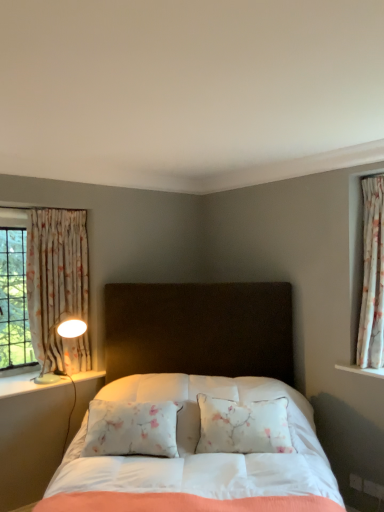
Question: Could you tell me if floral fabric curtain at left, which is the 2th curtain in right-to-left order, is turned towards white glossy lamp at left?

Choices:
 (A) no
 (B) yes

Answer: (A)

Question: Are floral fabric curtain at left, which is the first curtain in left-to-right order, and white glossy lamp at left beside each other?

Choices:
 (A) yes
 (B) no

Answer: (B)

Question: From a real-world perspective, does floral fabric curtain at left, arranged as the 2th curtain when viewed from the front, stand above white glossy lamp at left?

Choices:
 (A) no
 (B) yes

Answer: (B)

Question: Is floral fabric curtain at left, which is the first curtain in left-to-right order, outside of white glossy lamp at left?

Choices:
 (A) no
 (B) yes

Answer: (B)

Question: Is floral fabric curtain at left, which is the first curtain in left-to-right order, thinner than white glossy lamp at left?

Choices:
 (A) no
 (B) yes

Answer: (B)

Question: From the image's perspective, is floral fabric curtain at left, arranged as the 2th curtain when viewed from the front, below white glossy lamp at left?

Choices:
 (A) no
 (B) yes

Answer: (A)

Question: From the image's perspective, is white fabric bed at center under white glossy lamp at left?

Choices:
 (A) yes
 (B) no

Answer: (A)

Question: Is white fabric bed at center next to white glossy lamp at left and touching it?

Choices:
 (A) yes
 (B) no

Answer: (B)

Question: Would you say white fabric bed at center is outside white glossy lamp at left?

Choices:
 (A) no
 (B) yes

Answer: (B)

Question: Is white fabric bed at center to the right of white glossy lamp at left from the viewer's perspective?

Choices:
 (A) no
 (B) yes

Answer: (B)

Question: Does white fabric bed at center have a greater width compared to white glossy lamp at left?

Choices:
 (A) yes
 (B) no

Answer: (A)

Question: From a real-world perspective, is white fabric bed at center beneath white glossy lamp at left?

Choices:
 (A) no
 (B) yes

Answer: (B)

Question: Is white glossy lamp at left wider than floral fabric curtain at right, the 1th curtain from the front?

Choices:
 (A) no
 (B) yes

Answer: (B)